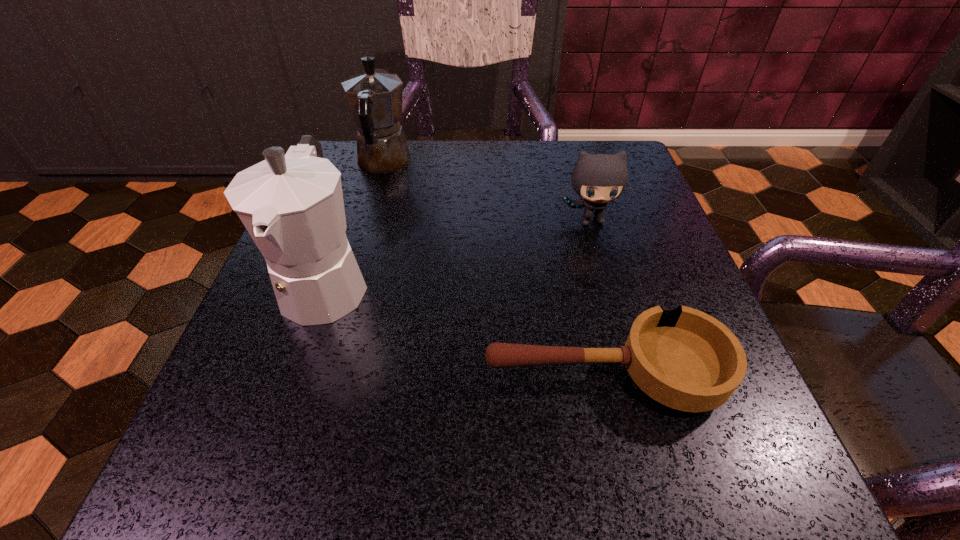
Where is `object that is at the far edge`? The height and width of the screenshot is (540, 960). object that is at the far edge is located at coordinates (375, 97).

Image resolution: width=960 pixels, height=540 pixels. In order to click on kitten that is at the right edge in this screenshot , I will do `click(597, 178)`.

You are a GUI agent. You are given a task and a screenshot of the screen. Output one action in this format:
    pyautogui.click(x=<x>, y=<y>)
    Task: Click on the saucepan that is at the right edge
    This screenshot has height=540, width=960.
    Given the screenshot: What is the action you would take?
    pyautogui.click(x=685, y=359)

Identify the location of object located in the far left corner section of the desktop. coord(375,97).

Identify the location of free spot at the far edge of the desktop. The image size is (960, 540). (460, 166).

In the image, there is a desktop. Identify the location of vacant space at the near edge. (474, 483).

The height and width of the screenshot is (540, 960). In the image, there is a desktop. In order to click on vacant space at the right edge in this screenshot , I will do `click(655, 215)`.

You are a GUI agent. You are given a task and a screenshot of the screen. Output one action in this format:
    pyautogui.click(x=<x>, y=<y>)
    Task: Click on the vacant position at the far left corner of the desktop
    
    Given the screenshot: What is the action you would take?
    pyautogui.click(x=357, y=168)

The height and width of the screenshot is (540, 960). In the image, there is a desktop. Identify the location of vacant space at the near right corner. (790, 510).

You are a GUI agent. You are given a task and a screenshot of the screen. Output one action in this format:
    pyautogui.click(x=<x>, y=<y>)
    Task: Click on the unoccupied area between the nearer coffeepot and the kitten
    The height and width of the screenshot is (540, 960).
    Given the screenshot: What is the action you would take?
    pyautogui.click(x=459, y=251)